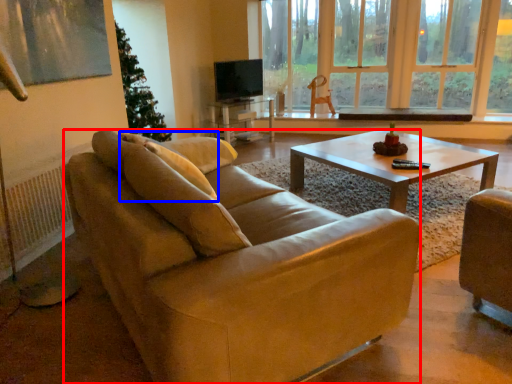
Question: Which object appears closest to the camera in this image, studio couch (highlighted by a red box) or pillow (highlighted by a blue box)?

Choices:
 (A) studio couch
 (B) pillow

Answer: (A)